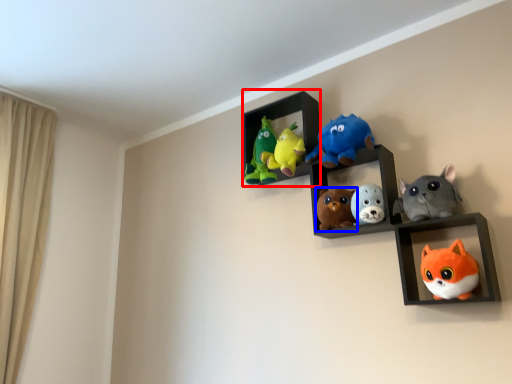
Question: Among these objects, which one is farthest to the camera, cabinet (highlighted by a red box) or toy (highlighted by a blue box)?

Choices:
 (A) cabinet
 (B) toy

Answer: (A)